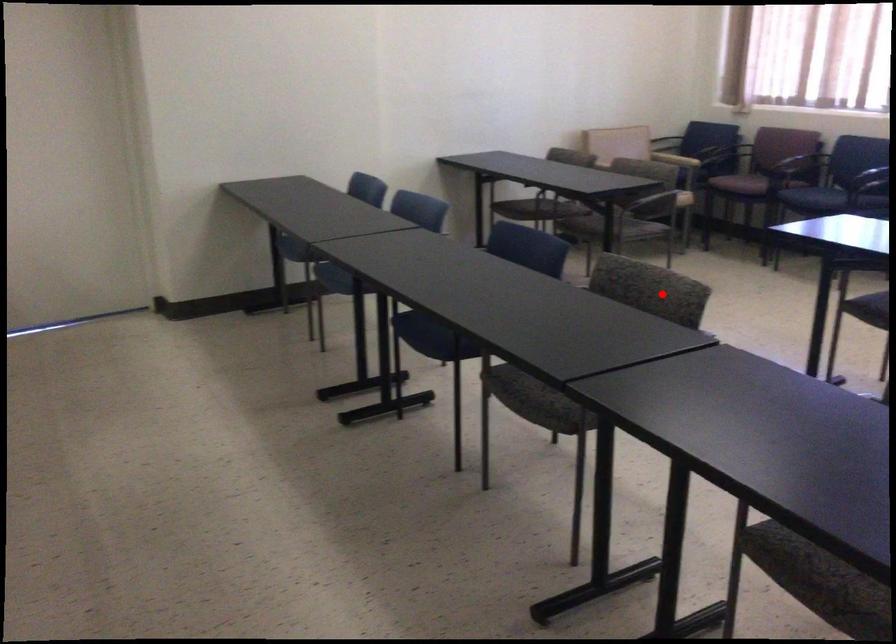
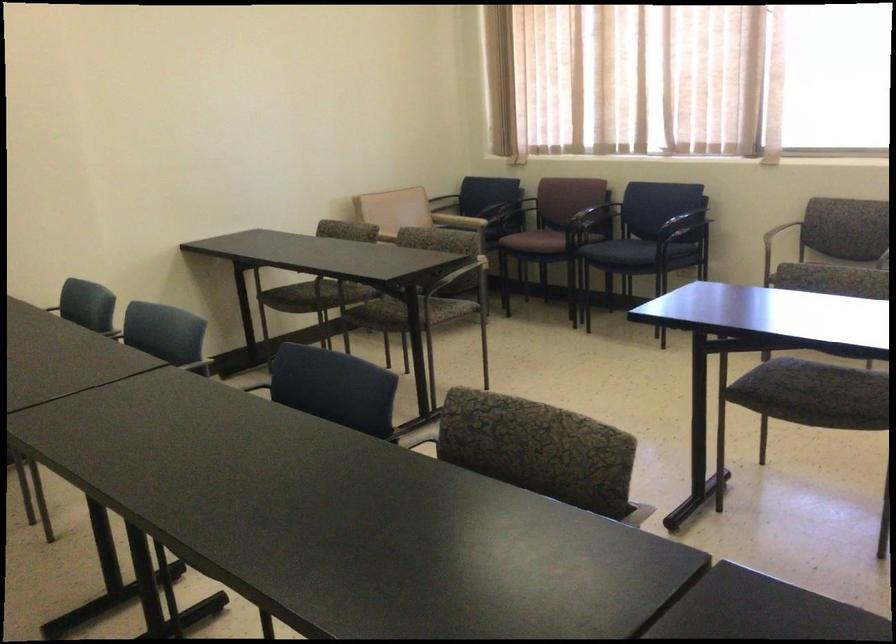
Find the pixel in the second image that matches the highlighted location in the first image.

(538, 449)